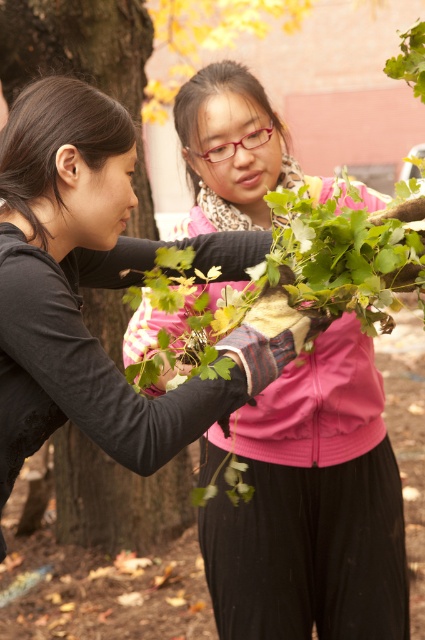
Question: Is pink fabric at center bigger than brown rough tree trunk at left?

Choices:
 (A) no
 (B) yes

Answer: (A)

Question: Among these objects, which one is farthest from the camera?

Choices:
 (A) brown rough tree trunk at left
 (B) pink fabric at center

Answer: (A)

Question: Can you confirm if pink fabric at center is positioned above brown rough tree trunk at left?

Choices:
 (A) no
 (B) yes

Answer: (A)

Question: In this image, where is pink fabric at center located relative to brown rough tree trunk at left?

Choices:
 (A) right
 (B) left

Answer: (A)